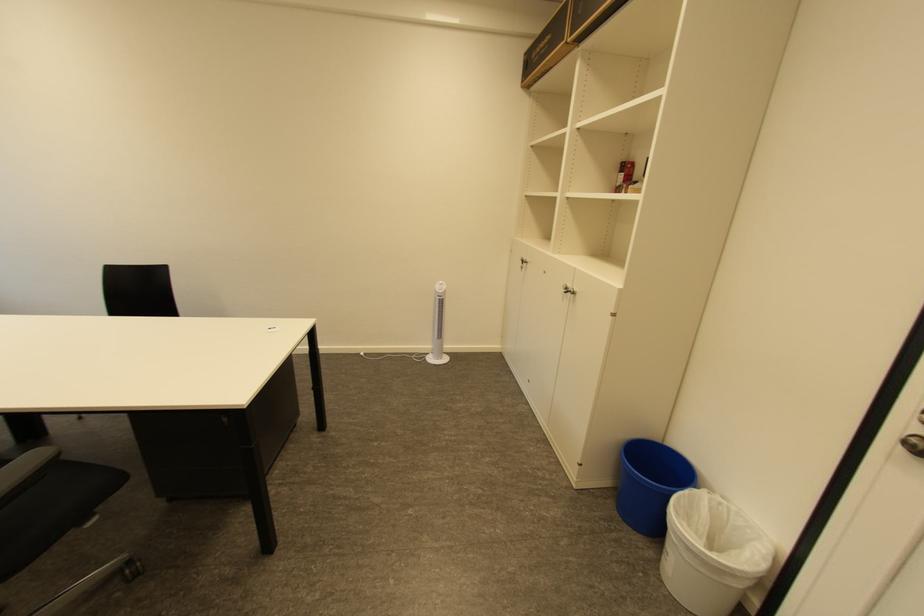
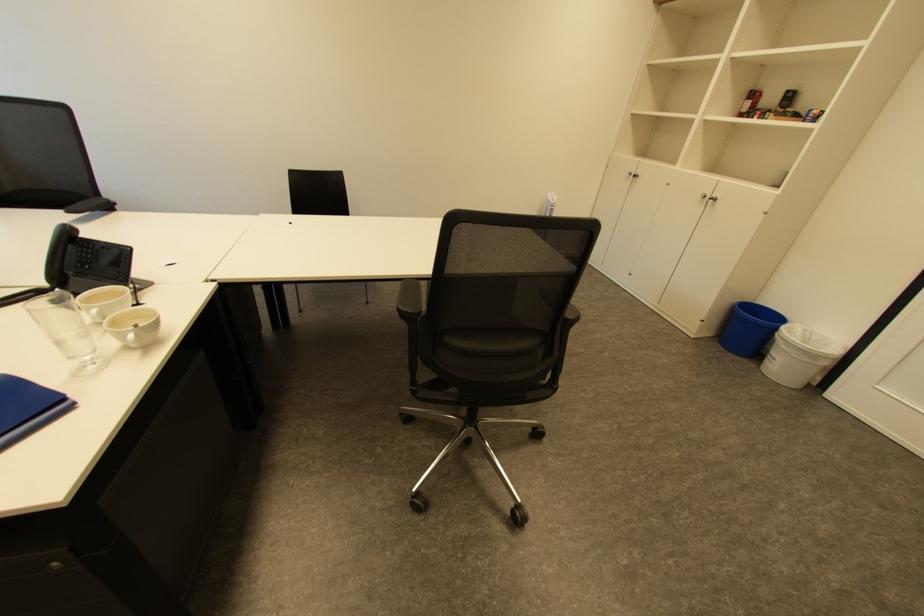
Locate, in the second image, the point that corresponds to point (657, 553) in the first image.

(760, 365)